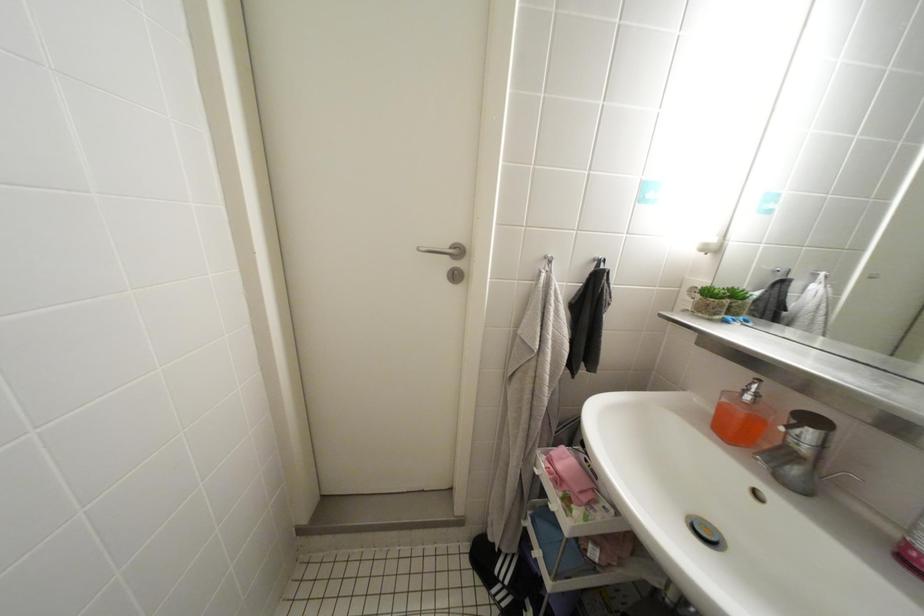
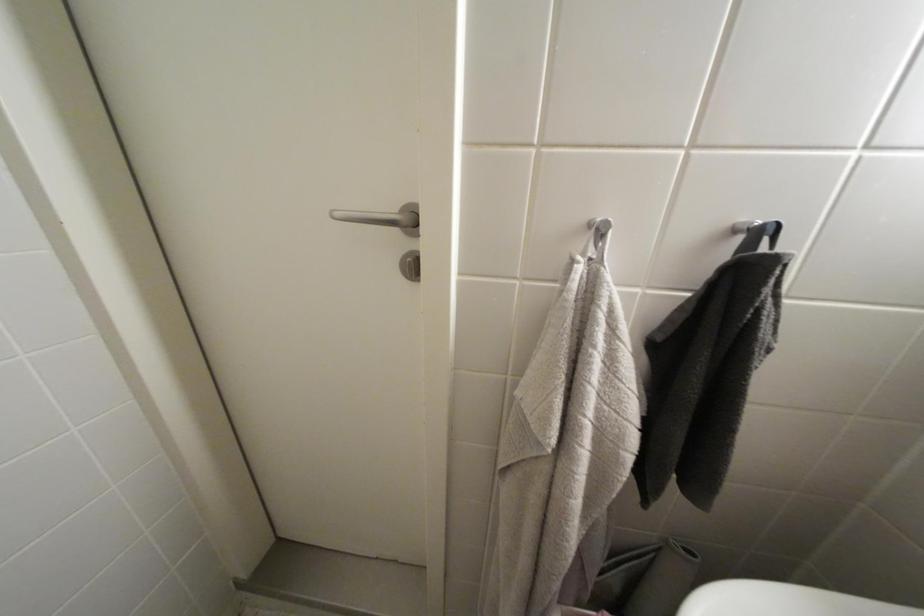
Question: The camera is either moving clockwise (left) or counter-clockwise (right) around the object. The first image is from the beginning of the video and the second image is from the end. Is the camera moving left or right when shooting the video?

Choices:
 (A) Left
 (B) Right

Answer: (B)